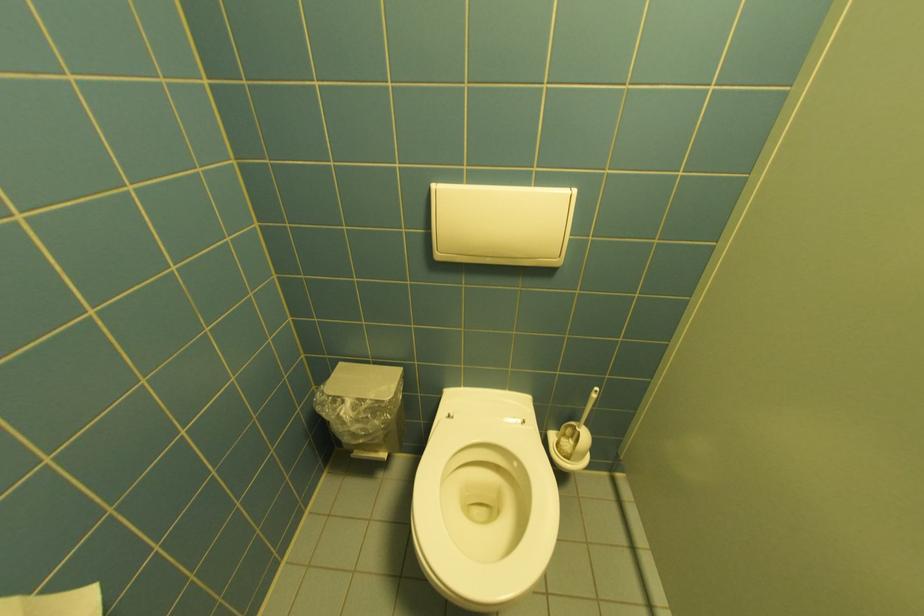
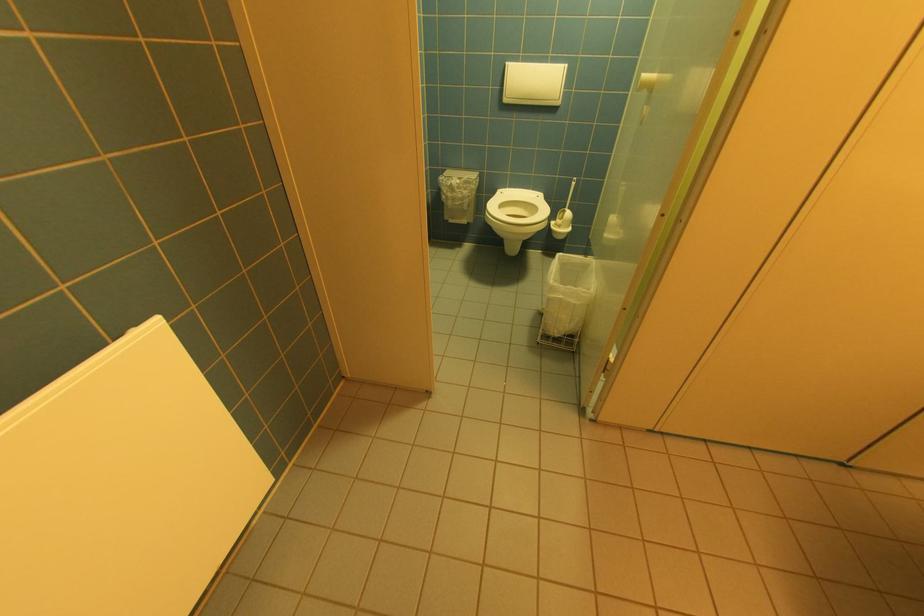
Find the pixel in the second image that matches the point at 444,256 in the first image.

(512, 100)